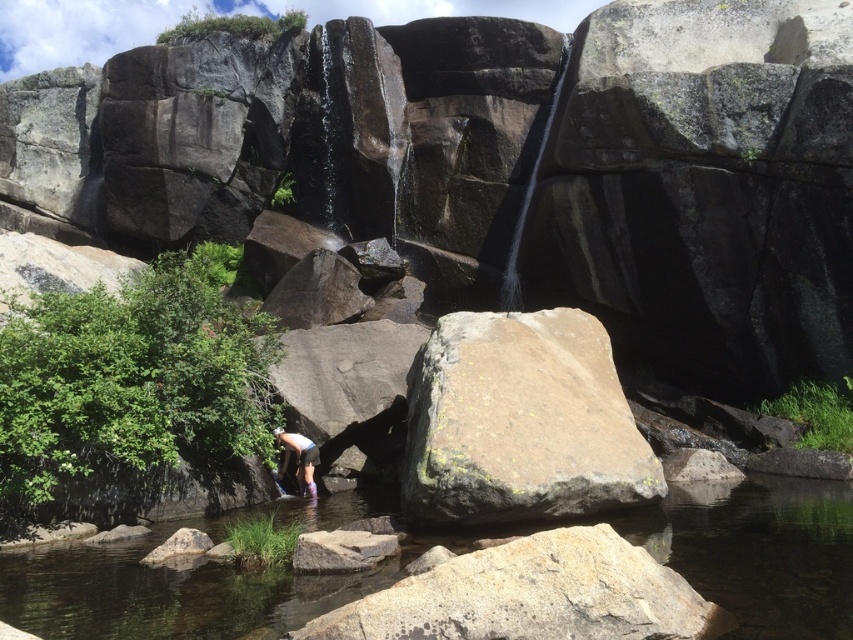
Question: Is clear water at center wider than white matte shorts at lower center?

Choices:
 (A) yes
 (B) no

Answer: (A)

Question: Based on their relative distances, which object is farther from the white matte shorts at lower center?

Choices:
 (A) clear water at center
 (B) brown rough rock at center

Answer: (B)

Question: Which point is farther from the camera taking this photo?

Choices:
 (A) (463, 397)
 (B) (283, 451)
 (C) (815, 483)

Answer: (B)

Question: Considering the relative positions of brown rough rock at center and white matte shorts at lower center in the image provided, where is brown rough rock at center located with respect to white matte shorts at lower center?

Choices:
 (A) below
 (B) above

Answer: (B)

Question: Is clear water at center thinner than white matte shorts at lower center?

Choices:
 (A) yes
 (B) no

Answer: (B)

Question: Which is nearer to the clear water at center?

Choices:
 (A) white matte shorts at lower center
 (B) brown rough rock at center

Answer: (B)